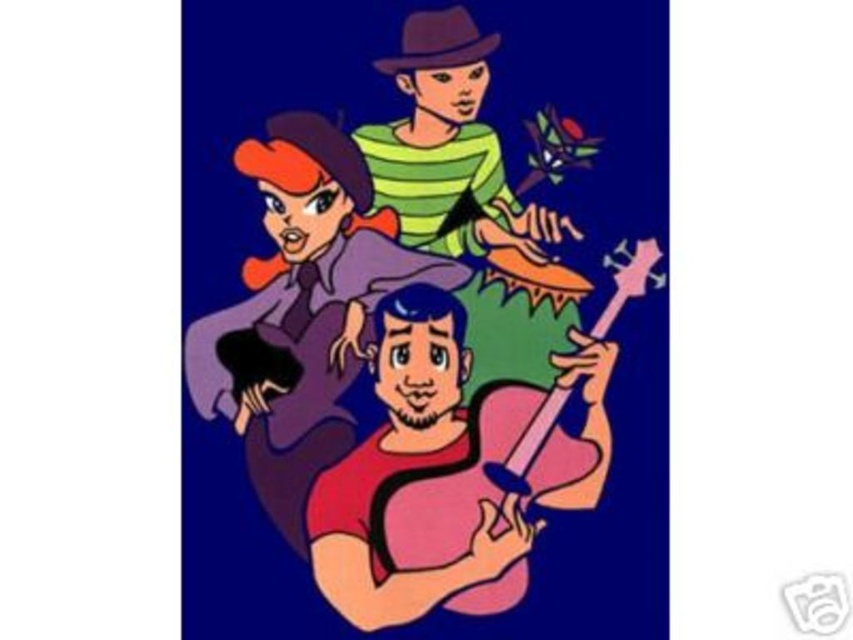
Based on the scene description, which object is positioned lower in the image, the pink matte guitar at center or the smooth purple dress at center?

The pink matte guitar at center is positioned lower than the smooth purple dress at center according to the description.

Based on the photo, you are a photographer setting up a camera to capture the two central characters in the image. The camera has a focal length of 50mm and is positioned 1.5 meters away from the scene. Given that the pink matte guitar at center and the smooth purple dress at center are only 9.82 centimeters apart, will the camera be able to clearly distinguish both objects in the photo?

The pink matte guitar at center is 9.82 centimeters from the smooth purple dress at center. At a distance of 1.5 meters, the separation between them is sufficient for a 50mm lens to distinguish both objects clearly, as the minimum resolvable distance for such a lens at that range is typically around 1cm or less.

You are an animator trying to position a spotlight on the pink glossy guitar at center. According to the coordinates provided, where should you place the spotlight to ensure it directly illuminates the guitar?

The pink glossy guitar at center is located at point (421, 316), so placing the spotlight at those coordinates will directly illuminate it.